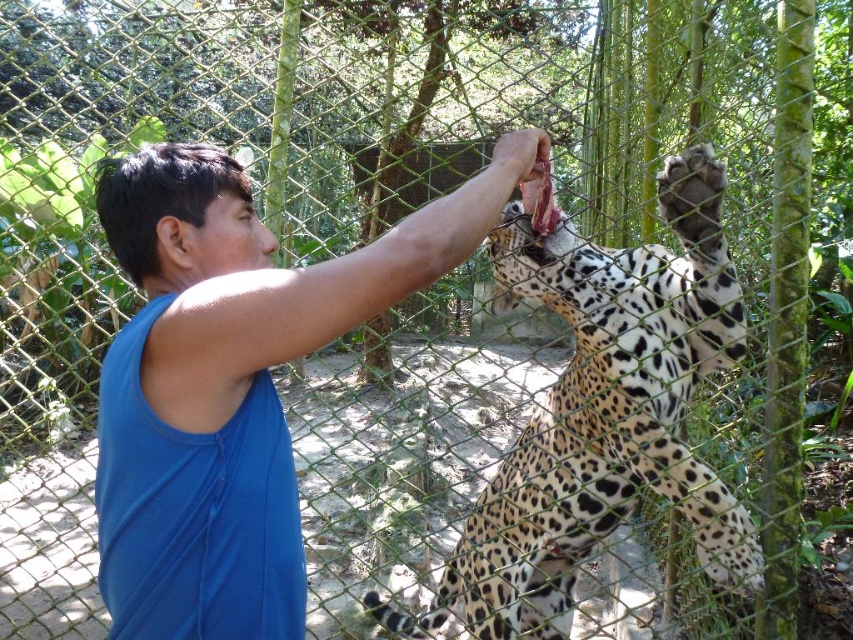
Question: Does blue fabric shirt at center have a larger size compared to spotted fur leopard at center?

Choices:
 (A) yes
 (B) no

Answer: (B)

Question: Where is blue fabric shirt at center located in relation to spotted fur leopard at center in the image?

Choices:
 (A) above
 (B) below

Answer: (A)

Question: Which point appears closest to the camera in this image?

Choices:
 (A) (125, 332)
 (B) (677, 406)

Answer: (A)

Question: Does blue fabric shirt at center have a larger size compared to spotted fur leopard at center?

Choices:
 (A) yes
 (B) no

Answer: (B)